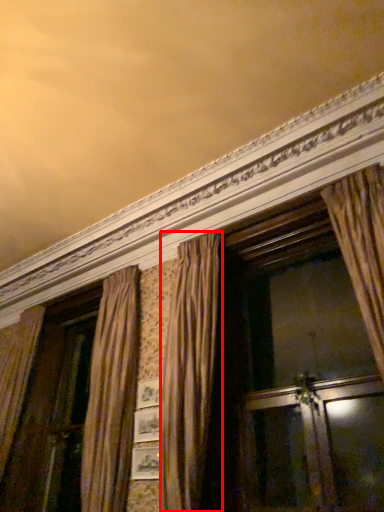
Question: From the image's perspective, considering the relative positions of curtain (annotated by the red box) and screen door in the image provided, where is curtain (annotated by the red box) located with respect to the staircase?

Choices:
 (A) above
 (B) below

Answer: (A)